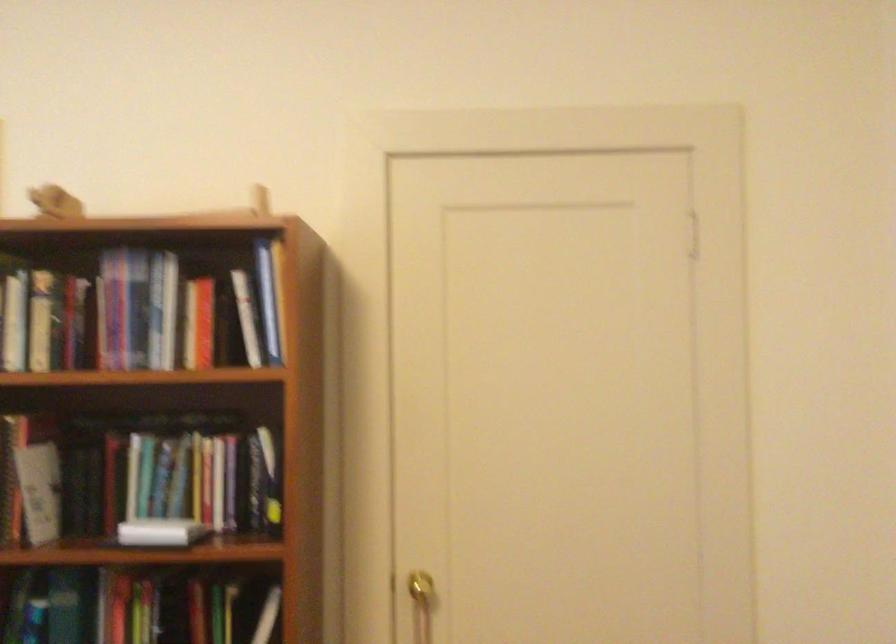
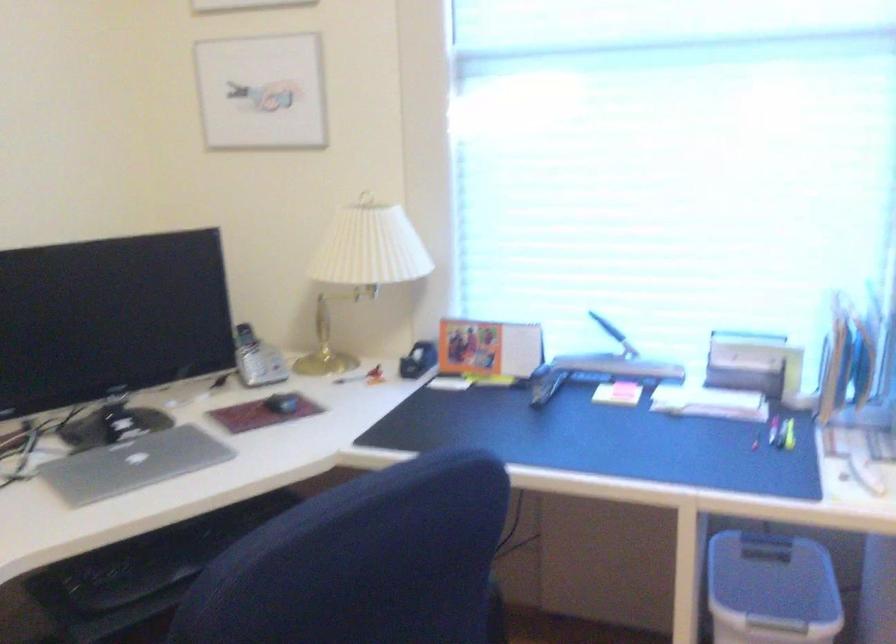
Based on the continuous images, in which direction is the camera rotating?

The rotation direction of the camera is left-down.